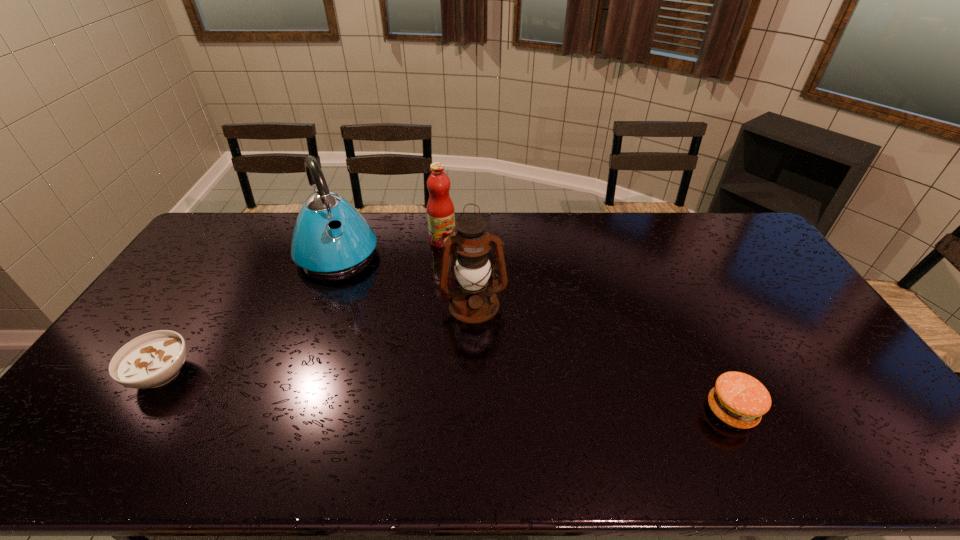
Locate an element on the screen. This screenshot has width=960, height=540. soup bowl located in the near edge section of the desktop is located at coordinates (151, 360).

Find the location of `patty at the near edge`. patty at the near edge is located at coordinates (738, 399).

This screenshot has height=540, width=960. Find the location of `object that is at the left edge`. object that is at the left edge is located at coordinates (151, 360).

Image resolution: width=960 pixels, height=540 pixels. What are the coordinates of `object at the near left corner` in the screenshot? It's located at (151, 360).

Find the location of `free region at the far edge of the desktop`. free region at the far edge of the desktop is located at coordinates pos(406,245).

At what (x,y) coordinates should I click in order to perform the action: click on vacant area at the near edge of the desktop. Please return your answer as a coordinate pair (x, y). The height and width of the screenshot is (540, 960). Looking at the image, I should click on (446, 395).

In order to click on vacant point at the left edge in this screenshot , I will do `click(230, 260)`.

Find the location of a particular element. vacant space at the right edge is located at coordinates (815, 342).

In the image, there is a desktop. What are the coordinates of `vacant area at the near left corner` in the screenshot? It's located at click(x=121, y=420).

This screenshot has width=960, height=540. I want to click on free spot between the third shortest object and the patty, so click(x=588, y=326).